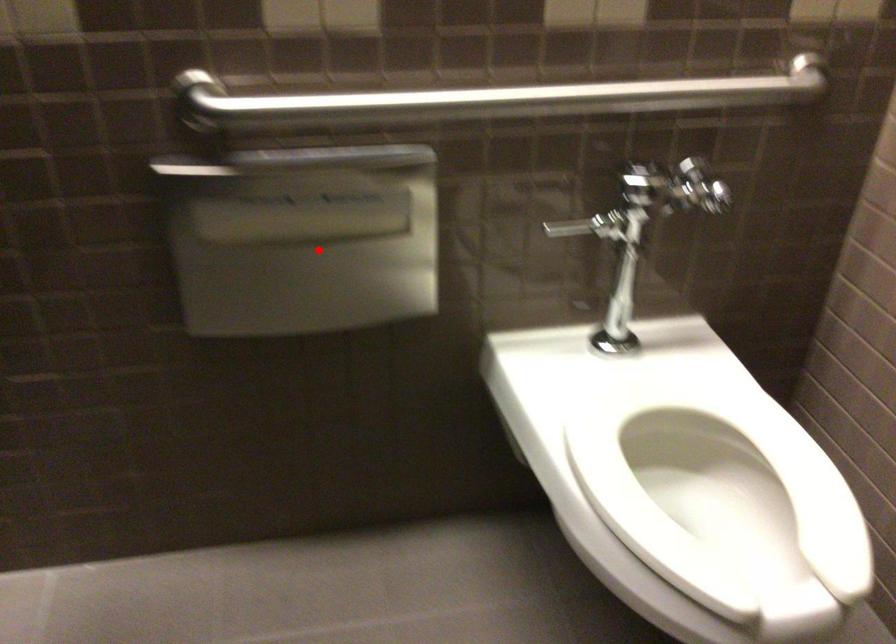
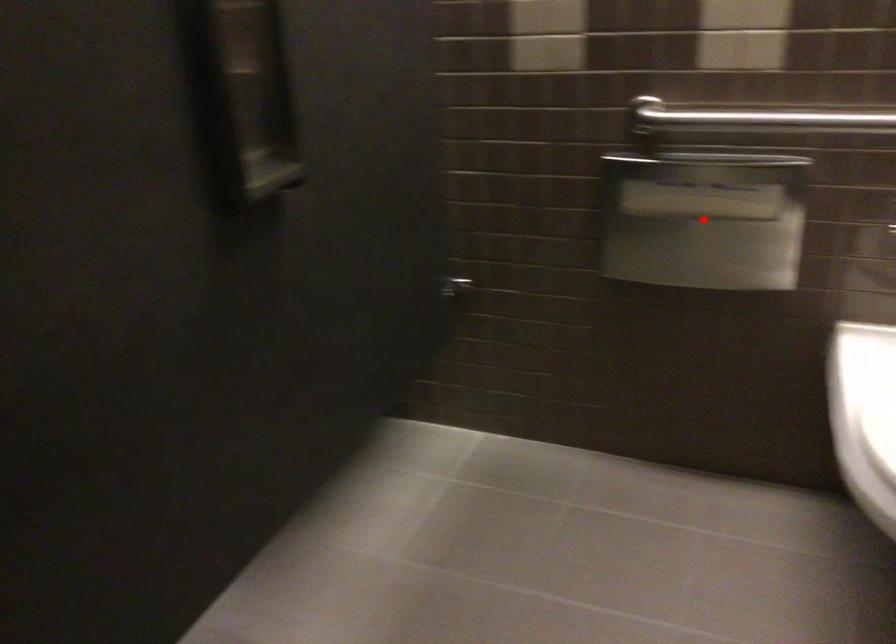
I am providing you with two images of the same scene from different viewpoints. A red point is marked on the first image and another point is marked on the second image. Do the highlighted points in image1 and image2 indicate the same real-world spot?

Yes